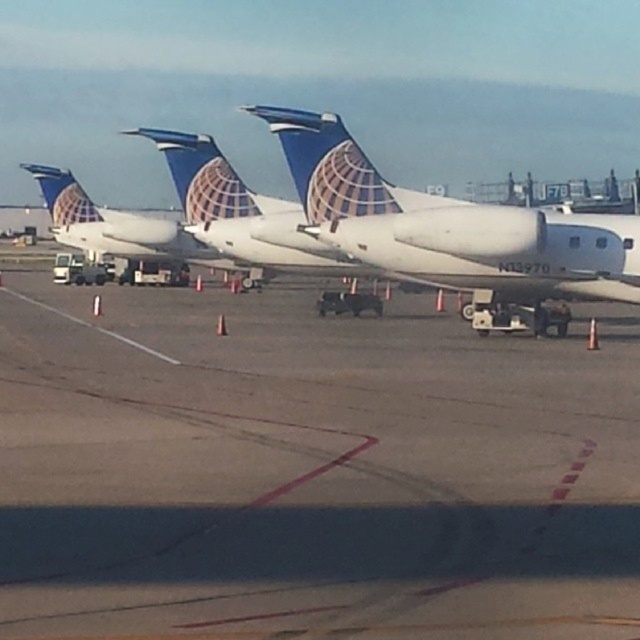
Is smooth asphalt tarmac at center to the right of white matte airplane at center from the viewer's perspective?

Yes, smooth asphalt tarmac at center is to the right of white matte airplane at center.

Is point (323, 321) more distant than point (593, 250)?

That is True.

What are the coordinates of `smooth asphalt tarmac at center` in the screenshot? It's located at (307, 472).